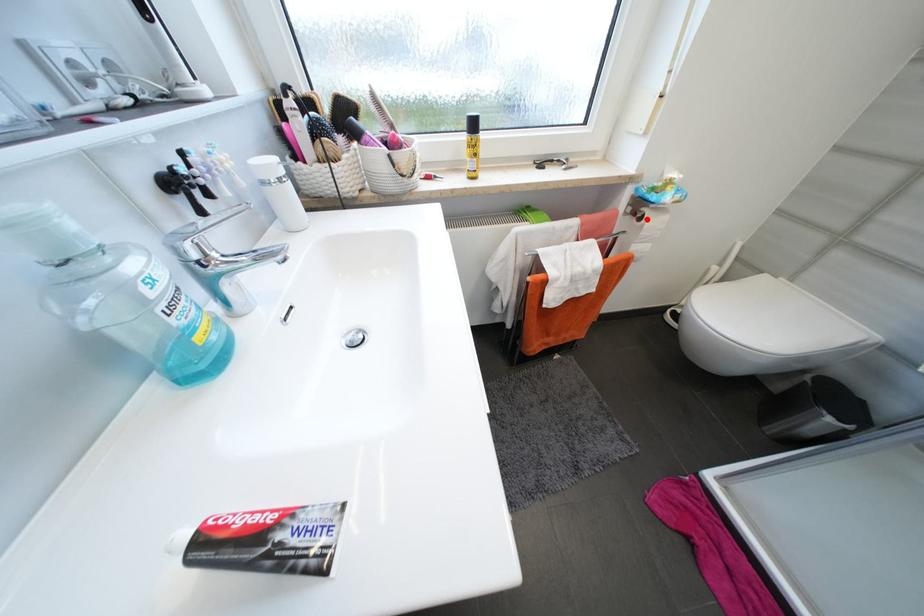
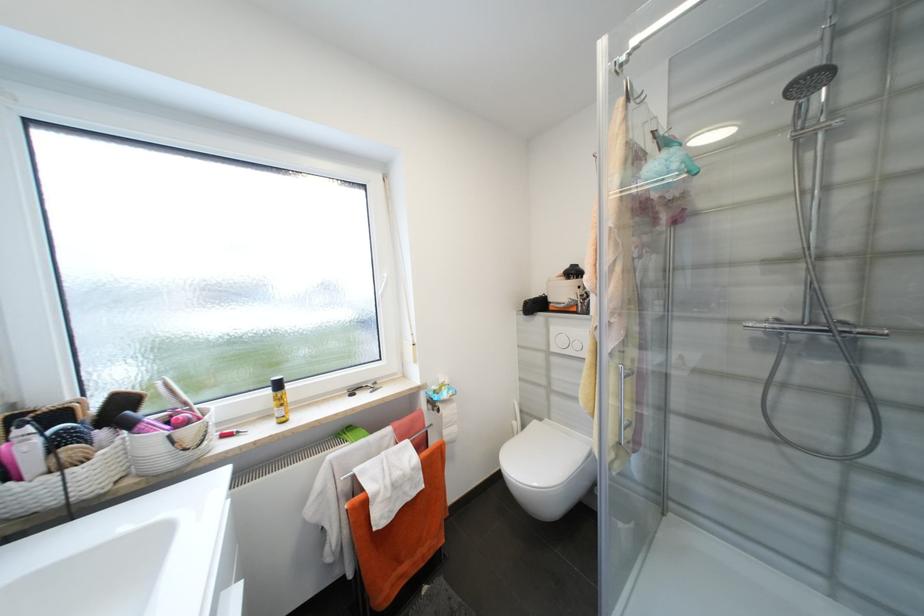
Question: I am providing you with two images of the same scene from different viewpoints. Given a red point in image1, look at the same physical point in image2. Is it:

Choices:
 (A) Closer to the viewpoint
 (B) Farther from the viewpoint

Answer: (B)